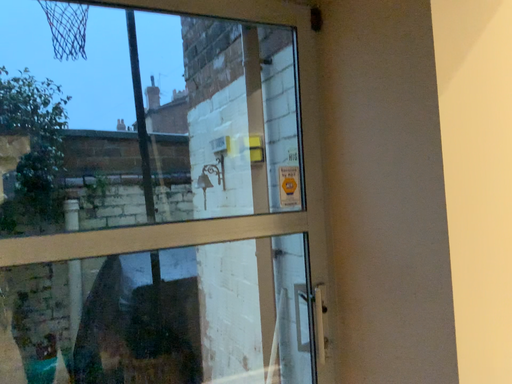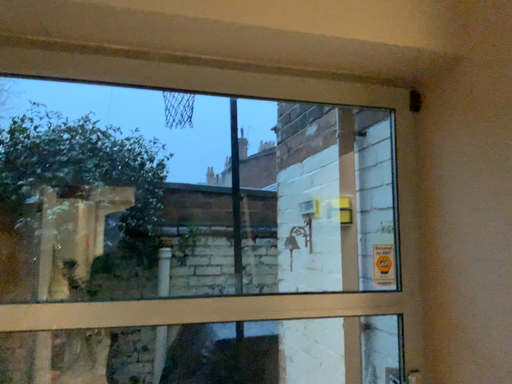
Question: How did the camera likely rotate when shooting the video?

Choices:
 (A) rotated upward
 (B) rotated downward

Answer: (A)